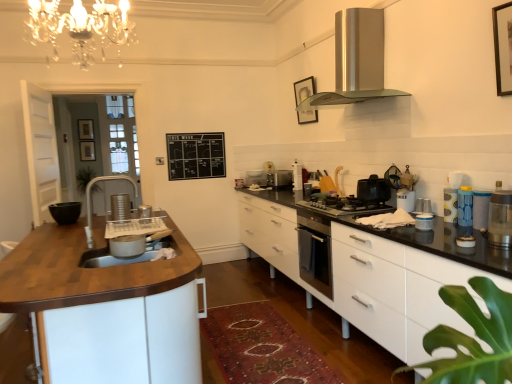
Question: Considering the relative positions of satin silver toaster at center, placed as the first appliance when sorted from back to front, and white glossy container at right, which appears as the seventh appliance when viewed from the left, in the image provided, is satin silver toaster at center, placed as the first appliance when sorted from back to front, behind white glossy container at right, which appears as the seventh appliance when viewed from the left,?

Choices:
 (A) yes
 (B) no

Answer: (A)

Question: Does satin silver toaster at center, arranged as the 2th appliance when viewed from the left, have a greater width compared to white glossy container at right, which appears as the seventh appliance when viewed from the left?

Choices:
 (A) yes
 (B) no

Answer: (A)

Question: Is satin silver toaster at center, which is the 10th appliance from right to left, oriented towards white glossy container at right, which is the fifth appliance from right to left?

Choices:
 (A) no
 (B) yes

Answer: (A)

Question: Considering the relative positions of satin silver toaster at center, placed as the eleventh appliance when sorted from front to back, and white glossy container at right, the 8th appliance when ordered from front to back, in the image provided, is satin silver toaster at center, placed as the eleventh appliance when sorted from front to back, to the left of white glossy container at right, the 8th appliance when ordered from front to back, from the viewer's perspective?

Choices:
 (A) yes
 (B) no

Answer: (A)

Question: From the image's perspective, is satin silver toaster at center, placed as the eleventh appliance when sorted from front to back, under white glossy container at right, which is the fifth appliance from right to left?

Choices:
 (A) yes
 (B) no

Answer: (B)

Question: Relative to satin silver toaster at left, arranged as the eleventh appliance when viewed from the right, is satin silver toaster at center, arranged as the 2th appliance when viewed from the left, in front or behind?

Choices:
 (A) behind
 (B) front

Answer: (A)

Question: Looking at the image, does satin silver toaster at center, which is the 10th appliance from right to left, seem bigger or smaller compared to satin silver toaster at left, arranged as the eleventh appliance when viewed from the right?

Choices:
 (A) big
 (B) small

Answer: (A)

Question: Considering the positions of satin silver toaster at center, arranged as the 2th appliance when viewed from the left, and satin silver toaster at left, acting as the first appliance starting from the left, in the image, is satin silver toaster at center, arranged as the 2th appliance when viewed from the left, wider or thinner than satin silver toaster at left, acting as the first appliance starting from the left,?

Choices:
 (A) wide
 (B) thin

Answer: (A)

Question: Considering the positions of satin silver toaster at center, placed as the first appliance when sorted from back to front, and satin silver toaster at left, acting as the first appliance starting from the left, in the image, is satin silver toaster at center, placed as the first appliance when sorted from back to front, taller or shorter than satin silver toaster at left, acting as the first appliance starting from the left,?

Choices:
 (A) tall
 (B) short

Answer: (A)

Question: In terms of width, does metallic silver toaster at upper right, which is counted as the sixth appliance, starting from the front, look wider or thinner when compared to translucent plastic container at right, the first kitchen appliance when ordered from right to left?

Choices:
 (A) thin
 (B) wide

Answer: (A)

Question: In terms of size, does metallic silver toaster at upper right, the 4th appliance viewed from the right, appear bigger or smaller than translucent plastic container at right, which is the second kitchen appliance from left to right?

Choices:
 (A) big
 (B) small

Answer: (B)

Question: Based on their positions, is metallic silver toaster at upper right, acting as the 6th appliance starting from the back, located to the left or right of translucent plastic container at right, which is the 2th kitchen appliance in back-to-front order?

Choices:
 (A) left
 (B) right

Answer: (A)

Question: Does point (428, 213) appear closer or farther from the camera than point (492, 243)?

Choices:
 (A) farther
 (B) closer

Answer: (A)

Question: From the image's perspective, is satin silver range hood at upper center positioned above or below translucent plastic container at right, which is the second kitchen appliance from left to right?

Choices:
 (A) below
 (B) above

Answer: (B)

Question: Is satin silver range hood at upper center inside the boundaries of translucent plastic container at right, which is the 2th kitchen appliance in back-to-front order, or outside?

Choices:
 (A) inside
 (B) outside

Answer: (B)